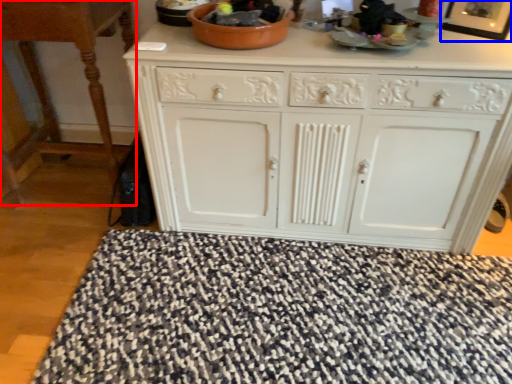
Question: Which object appears closest to the camera in this image, table (highlighted by a red box) or picture frame (highlighted by a blue box)?

Choices:
 (A) table
 (B) picture frame

Answer: (B)